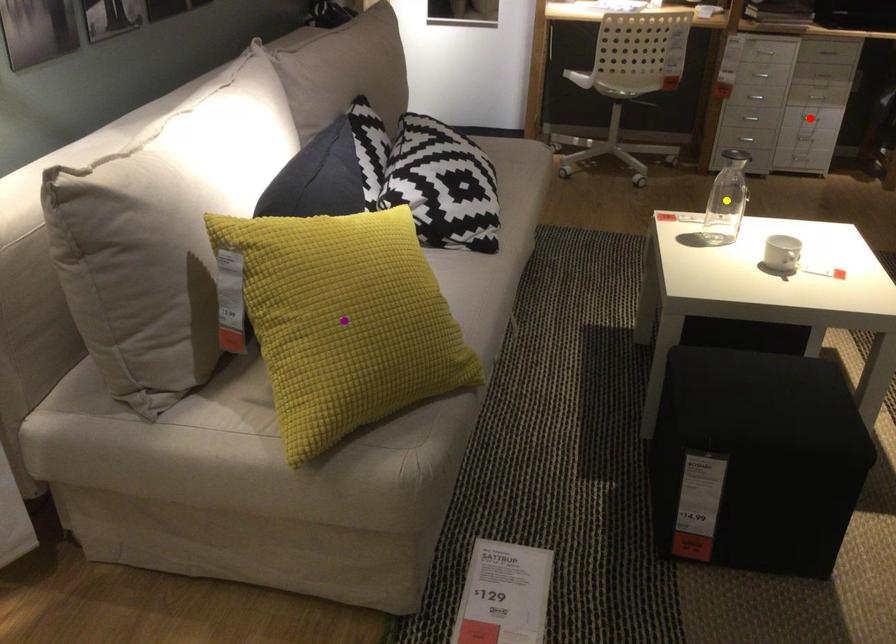
Order these from nearest to farthest:
1. purple point
2. yellow point
3. red point

1. purple point
2. yellow point
3. red point